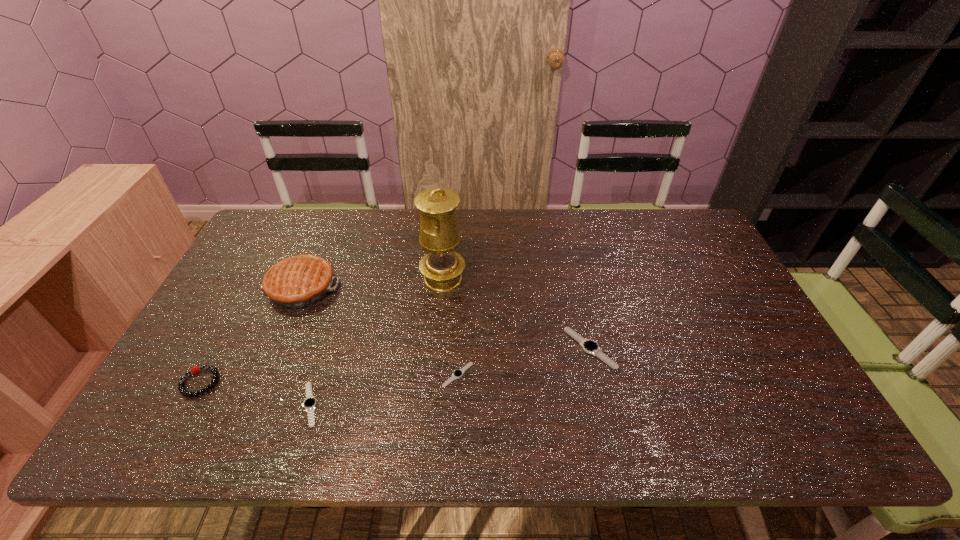
In order to click on the fifth tallest object in this screenshot , I will do coord(309,404).

The width and height of the screenshot is (960, 540). I want to click on the second tallest watch, so click(x=309, y=404).

Locate an element on the screen. The image size is (960, 540). the shortest object is located at coordinates [x=458, y=373].

At what (x,y) coordinates should I click in order to perform the action: click on the shortest watch. Please return your answer as a coordinate pair (x, y). Looking at the image, I should click on (458, 373).

What are the coordinates of `the rightmost object` in the screenshot? It's located at tap(591, 347).

Identify the location of the third shortest object. Image resolution: width=960 pixels, height=540 pixels. (591, 347).

The width and height of the screenshot is (960, 540). In order to click on the tallest object in this screenshot , I will do `click(442, 267)`.

At what (x,y) coordinates should I click in order to perform the action: click on pie. Please return your answer as a coordinate pair (x, y). The image size is (960, 540). Looking at the image, I should click on (295, 282).

The height and width of the screenshot is (540, 960). Find the location of `bracelet`. bracelet is located at coordinates (181, 388).

Where is `free spot located on the left of the second shortest watch`? This screenshot has width=960, height=540. free spot located on the left of the second shortest watch is located at coordinates (223, 404).